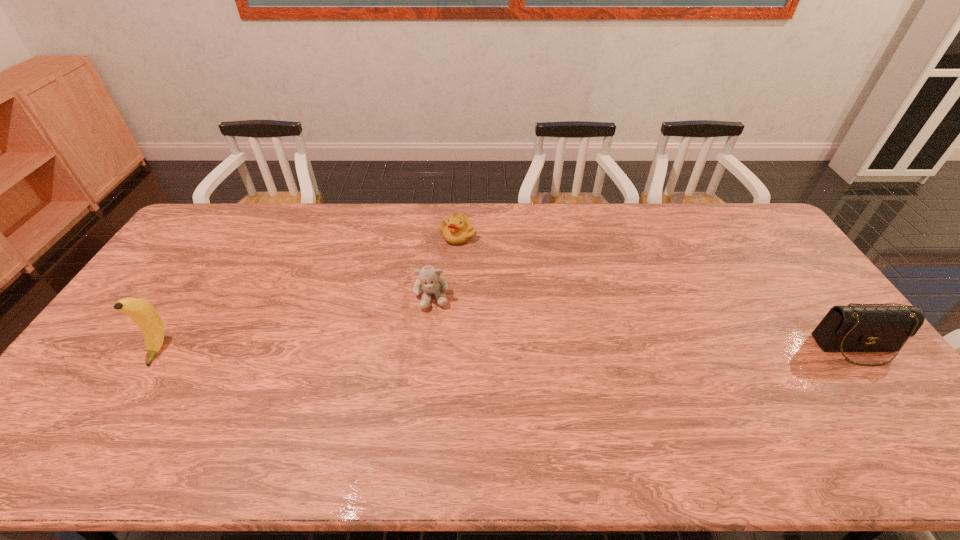
I want to click on vacant spot on the desktop that is between the leftmost object and the clutch bag and is positioned on the front-facing side of the farthest object, so click(x=419, y=349).

Locate an element on the screen. This screenshot has height=540, width=960. free space on the desktop that is between the tallest object and the rightmost object and is positioned on the face of the teddy bear is located at coordinates (436, 349).